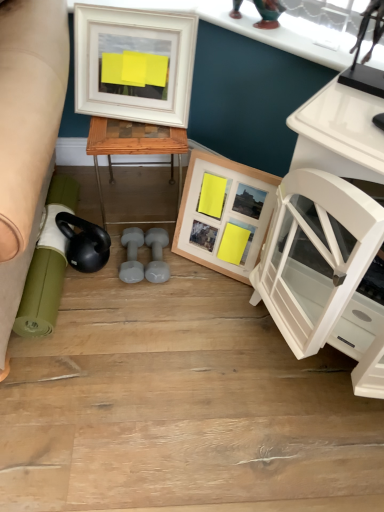
Image resolution: width=384 pixels, height=512 pixels. What are the coordinates of `vacant area on top of woodenobject at center (from a real-world perspective)` in the screenshot? It's located at (143, 125).